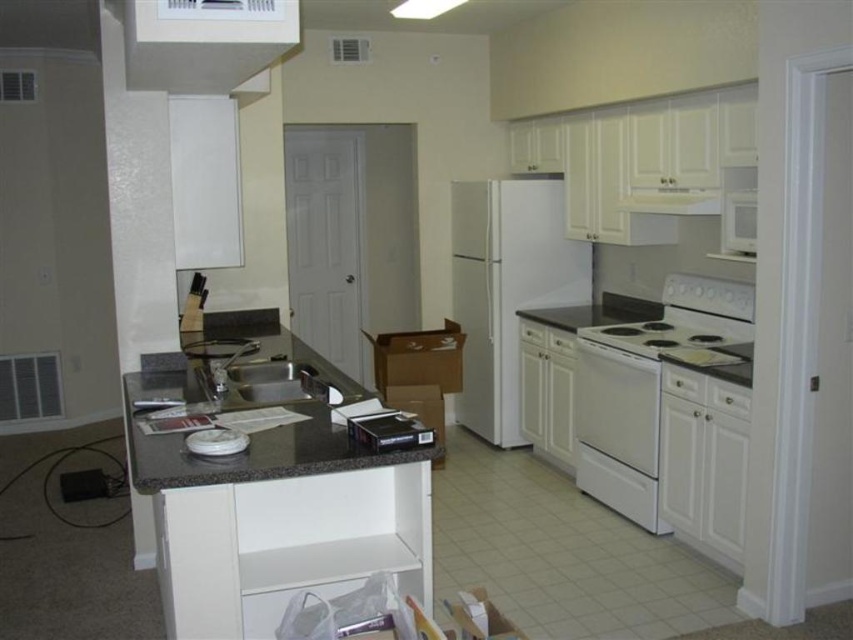
Who is shorter, white glossy electric stove at lower right or satin silver sink at center?

white glossy electric stove at lower right is shorter.

Can you confirm if white glossy electric stove at lower right is thinner than satin silver sink at center?

No, white glossy electric stove at lower right is not thinner than satin silver sink at center.

The width and height of the screenshot is (853, 640). Describe the element at coordinates (660, 337) in the screenshot. I see `white glossy electric stove at lower right` at that location.

Where is `white glossy electric stove at lower right`? This screenshot has height=640, width=853. white glossy electric stove at lower right is located at coordinates pos(660,337).

Can you confirm if white matte refrigerator at center is positioned to the right of white glossy oven at lower right?

No, white matte refrigerator at center is not to the right of white glossy oven at lower right.

Is white matte refrigerator at center closer to camera compared to white glossy oven at lower right?

No, white matte refrigerator at center is further to the viewer.

Who is more forward, [488,269] or [606,355]?

Point [606,355]

The width and height of the screenshot is (853, 640). In order to click on white matte refrigerator at center in this screenshot , I will do `click(506, 289)`.

Does white glossy electric stove at center-right appear under satin silver sink at center?

Yes, white glossy electric stove at center-right is below satin silver sink at center.

Is white glossy electric stove at center-right behind satin silver sink at center?

Yes, it is.

Which is in front, point (686, 321) or point (300, 388)?

Point (300, 388)

The height and width of the screenshot is (640, 853). Identify the location of white glossy electric stove at center-right. tap(643, 388).